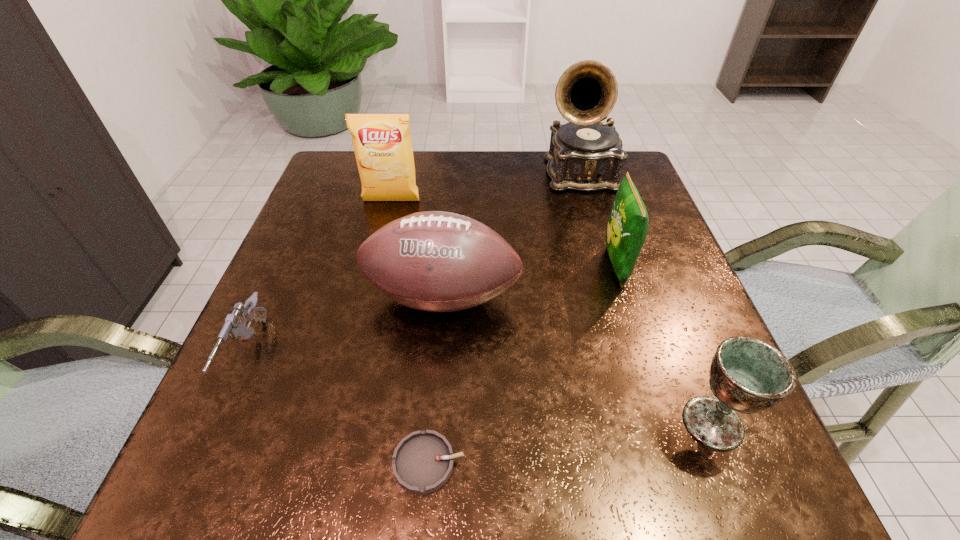
The width and height of the screenshot is (960, 540). What are the coordinates of `free point located on the horn of the phonograph record` in the screenshot? It's located at (607, 269).

The image size is (960, 540). Identify the location of free space located on the front of the taller crisp (potato chip) with the logo. (358, 339).

At what (x,y) coordinates should I click in order to perform the action: click on free point located 0.280m on the right of the football (American). Please return your answer as a coordinate pair (x, y). This screenshot has width=960, height=540. Looking at the image, I should click on (662, 298).

Locate an element on the screen. free space located on the front-facing side of the right crisp (potato chip) is located at coordinates (466, 265).

Find the location of a particular element. This screenshot has height=540, width=960. vacant space located on the front-facing side of the right crisp (potato chip) is located at coordinates (494, 265).

At what (x,y) coordinates should I click in order to perform the action: click on vacant space located on the front-facing side of the right crisp (potato chip). Please return your answer as a coordinate pair (x, y). The image size is (960, 540). Looking at the image, I should click on (466, 265).

The width and height of the screenshot is (960, 540). What are the coordinates of `vacant region located 0.190m on the left of the third shortest object` in the screenshot? It's located at [x=559, y=423].

Where is `free location located at the barrel of the sixth tallest object`? This screenshot has height=540, width=960. free location located at the barrel of the sixth tallest object is located at coordinates (205, 453).

Locate an element on the screen. free space located on the back of the shortest object is located at coordinates (443, 293).

What are the coordinates of `phonograph record located at the far edge` in the screenshot? It's located at (585, 154).